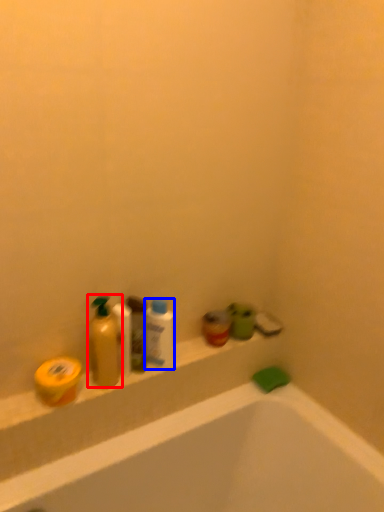
Question: Which point is closer to the camera, cleaning product (highlighted by a red box) or mouthwash (highlighted by a blue box)?

Choices:
 (A) cleaning product
 (B) mouthwash

Answer: (A)